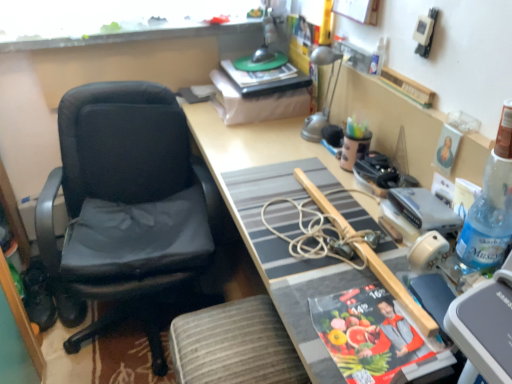
Image resolution: width=512 pixels, height=384 pixels. What do you see at coordinates (114, 21) in the screenshot?
I see `transparent glass window at upper center` at bounding box center [114, 21].

What do you see at coordinates (368, 334) in the screenshot? I see `matte paper magazine at lower right` at bounding box center [368, 334].

Measure the distance between wooden picture frame at upper center and camera.

1.24 meters.

Image resolution: width=512 pixels, height=384 pixels. Describe the element at coordinates (358, 10) in the screenshot. I see `wooden picture frame at upper center` at that location.

What is the approximate height of transparent plastic spray bottle at upper right, which ranks as the 1th bottle in top-to-bottom order?

transparent plastic spray bottle at upper right, which ranks as the 1th bottle in top-to-bottom order, is 4.56 inches tall.

Image resolution: width=512 pixels, height=384 pixels. Describe the element at coordinates (378, 58) in the screenshot. I see `transparent plastic spray bottle at upper right, the 2th bottle viewed from the right` at that location.

Where is `transparent glass window at upper center`? transparent glass window at upper center is located at coordinates (114, 21).

Is matte paper magazine at lower right positioned in front of gray fabric stool at lower center?

Yes, it is.

From the image's perspective, who appears lower, matte paper magazine at lower right or gray fabric stool at lower center?

gray fabric stool at lower center, from the image's perspective.

Which is behind, point (403, 359) or point (174, 337)?

The point (174, 337) is more distant.

Is metallic silver device at upper right next to wooden picture frame at upper center and touching it?

They are not placed beside each other.

Considering the sizes of objects metallic silver device at upper right and wooden picture frame at upper center in the image provided, who is bigger, metallic silver device at upper right or wooden picture frame at upper center?

Bigger between the two is wooden picture frame at upper center.

Is metallic silver device at upper right oriented away from wooden picture frame at upper center?

No, metallic silver device at upper right is not facing away from wooden picture frame at upper center.

Measure the distance between metallic silver device at upper right and wooden picture frame at upper center.

A distance of 23.91 inches exists between metallic silver device at upper right and wooden picture frame at upper center.

Is gray fabric stool at lower center far away from matte paper magazine at lower right?

Actually, gray fabric stool at lower center and matte paper magazine at lower right are a little close together.

Based on their sizes in the image, would you say gray fabric stool at lower center is bigger or smaller than matte paper magazine at lower right?

Clearly, gray fabric stool at lower center is larger in size than matte paper magazine at lower right.

Between gray fabric stool at lower center and matte paper magazine at lower right, which one appears on the right side from the viewer's perspective?

matte paper magazine at lower right.

From a real-world perspective, does gray fabric stool at lower center sit lower than matte paper magazine at lower right?

Yes.

In terms of width, does metallic silver device at upper right look wider or thinner when compared to transparent plastic spray bottle at upper right, placed as the 1th bottle when sorted from left to right?

Considering their sizes, metallic silver device at upper right looks broader than transparent plastic spray bottle at upper right, placed as the 1th bottle when sorted from left to right.

Is transparent plastic spray bottle at upper right, the 2th bottle viewed from the right, a part of metallic silver device at upper right?

No, transparent plastic spray bottle at upper right, the 2th bottle viewed from the right, is not a part of metallic silver device at upper right.

Considering the sizes of objects metallic silver device at upper right and transparent plastic spray bottle at upper right, the 1th bottle from the back, in the image provided, who is bigger, metallic silver device at upper right or transparent plastic spray bottle at upper right, the 1th bottle from the back,?

With larger size is metallic silver device at upper right.

Are metallic silver device at upper right and transparent plastic spray bottle at upper right, placed as the 1th bottle when sorted from left to right, beside each other?

No, metallic silver device at upper right is not in contact with transparent plastic spray bottle at upper right, placed as the 1th bottle when sorted from left to right.

Is transparent plastic spray bottle at upper right, acting as the second bottle starting from the bottom, surrounding gray fabric stool at lower center?

Actually, gray fabric stool at lower center is outside transparent plastic spray bottle at upper right, acting as the second bottle starting from the bottom.

Is transparent plastic spray bottle at upper right, the 2th bottle viewed from the right, thinner than gray fabric stool at lower center?

Yes, transparent plastic spray bottle at upper right, the 2th bottle viewed from the right, is thinner than gray fabric stool at lower center.

From the image's perspective, who appears lower, transparent plastic spray bottle at upper right, placed as the 1th bottle when sorted from left to right, or gray fabric stool at lower center?

gray fabric stool at lower center, from the image's perspective.

Considering the sizes of transparent plastic spray bottle at upper right, the 1th bottle from the back, and gray fabric stool at lower center in the image, is transparent plastic spray bottle at upper right, the 1th bottle from the back, bigger or smaller than gray fabric stool at lower center?

Clearly, transparent plastic spray bottle at upper right, the 1th bottle from the back, is smaller in size than gray fabric stool at lower center.

Considering the positions of points (434, 211) and (493, 164), is point (434, 211) closer to camera compared to point (493, 164)?

No, (434, 211) is further to viewer.

Looking at this image, from a real-world perspective, which object stands above the other?

blue plastic bottle at right, which ranks as the first bottle in front-to-back order, from a real-world perspective.

What's the angular difference between transparent plastic spray bottle at upper right, placed as the 1th bottle when sorted from left to right, and silver metallic lamp at upper right's facing directions?

The angular difference between transparent plastic spray bottle at upper right, placed as the 1th bottle when sorted from left to right, and silver metallic lamp at upper right is 4 degrees.

From the picture: Could you tell me if transparent plastic spray bottle at upper right, which is the 2th bottle from front to back, is facing silver metallic lamp at upper right?

No, transparent plastic spray bottle at upper right, which is the 2th bottle from front to back, is not turned towards silver metallic lamp at upper right.

Is transparent plastic spray bottle at upper right, the 1th bottle from the back, in front of silver metallic lamp at upper right?

Yes, it is.

From the image's perspective, is transparent plastic spray bottle at upper right, placed as the 1th bottle when sorted from left to right, on top of silver metallic lamp at upper right?

Yes, from the image's perspective, transparent plastic spray bottle at upper right, placed as the 1th bottle when sorted from left to right, is over silver metallic lamp at upper right.

You are a GUI agent. You are given a task and a screenshot of the screen. Output one action in this format:
    pyautogui.click(x=<x>, y=<y>)
    Task: Click on the stool that is behind the matte paper magazine at lower right
    The height and width of the screenshot is (384, 512).
    Given the screenshot: What is the action you would take?
    pyautogui.click(x=234, y=345)

Locate an element on the screen. The width and height of the screenshot is (512, 384). equipment located in front of the wooden picture frame at upper center is located at coordinates (424, 210).

Estimate the real-world distances between objects in this image. Which object is closer to silver metallic lamp at upper right, matte paper magazine at lower right or blue plastic bottle at right, which is the second bottle from left to right?

blue plastic bottle at right, which is the second bottle from left to right.

From the image, which object appears to be farther from blue plastic bottle at right, the first bottle viewed from the right, gray fabric stool at lower center or transparent plastic spray bottle at upper right, acting as the second bottle starting from the bottom?

Among the two, gray fabric stool at lower center is located further to blue plastic bottle at right, the first bottle viewed from the right.

When comparing their distances from blue plastic bottle at right, the 1th bottle ordered from the bottom, does silver metallic lamp at upper right or wooden desk at center seem closer?

Among the two, wooden desk at center is located nearer to blue plastic bottle at right, the 1th bottle ordered from the bottom.

Which object lies further to the anchor point transparent glass window at upper center, matte paper magazine at lower right or metallic silver device at upper right?

Based on the image, matte paper magazine at lower right appears to be further to transparent glass window at upper center.

Based on their spatial positions, is transparent plastic spray bottle at upper right, which ranks as the 1th bottle in top-to-bottom order, or black leather chair at left closer to transparent glass window at upper center?

Among the two, black leather chair at left is located nearer to transparent glass window at upper center.

Which object lies nearer to the anchor point wooden desk at center, matte paper magazine at lower right or blue plastic bottle at right, the second bottle positioned from the top?

matte paper magazine at lower right is closer to wooden desk at center.

Considering their positions, is gray fabric stool at lower center positioned further to wooden desk at center than silver metallic lamp at upper right?

Based on the image, gray fabric stool at lower center appears to be further to wooden desk at center.

Based on their spatial positions, is transparent glass window at upper center or wooden picture frame at upper center further from silver metallic lamp at upper right?

transparent glass window at upper center is positioned further to the anchor silver metallic lamp at upper right.

What are the coordinates of `paperback book positioned between wooden desk at center and transparent glass window at upper center from near to far` in the screenshot? It's located at (368, 334).

Identify the location of equipment between wooden desk at center and transparent glass window at upper center in the front-back direction. (424, 210).

Identify the location of equipment between wooden picture frame at upper center and matte paper magazine at lower right vertically. Image resolution: width=512 pixels, height=384 pixels. (424, 210).

Locate an element on the screen. lamp between transparent glass window at upper center and matte paper magazine at lower right from top to bottom is located at coordinates (325, 94).